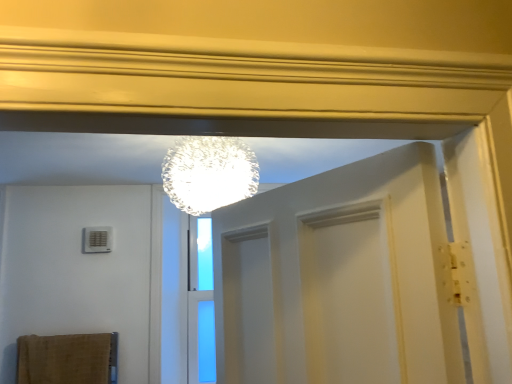
Describe the element at coordinates (67, 359) in the screenshot. The image size is (512, 384). I see `burlap bath towel at lower left` at that location.

Measure the distance between point (x=62, y=342) and camera.

Point (x=62, y=342) is 7.73 feet from camera.

In order to click on burlap bath towel at lower left in this screenshot , I will do `click(67, 359)`.

The height and width of the screenshot is (384, 512). What are the coordinates of `transparent glass sphere at upper center` in the screenshot? It's located at (209, 173).

In order to face transparent glass sphere at upper center, should I rotate leftwards or rightwards?

Turn left by 4.667 degrees to look at transparent glass sphere at upper center.

This screenshot has width=512, height=384. What do you see at coordinates (209, 173) in the screenshot?
I see `transparent glass sphere at upper center` at bounding box center [209, 173].

At what (x,y) coordinates should I click in order to perform the action: click on burlap bath towel at lower left. Please return your answer as a coordinate pair (x, y). Image resolution: width=512 pixels, height=384 pixels. Looking at the image, I should click on (67, 359).

Is burlap bath towel at lower left to the left of transparent glass sphere at upper center from the viewer's perspective?

Yes, burlap bath towel at lower left is to the left of transparent glass sphere at upper center.

Which object is further away from the camera, burlap bath towel at lower left or transparent glass sphere at upper center?

burlap bath towel at lower left is more distant.

Considering the points (54, 349) and (179, 201), which point is in front, point (54, 349) or point (179, 201)?

Positioned in front is point (179, 201).

From the image's perspective, between burlap bath towel at lower left and transparent glass sphere at upper center, which one is located above?

transparent glass sphere at upper center.

From a real-world perspective, is burlap bath towel at lower left physically located above or below transparent glass sphere at upper center?

burlap bath towel at lower left is situated lower than transparent glass sphere at upper center in the real world.

Can you confirm if burlap bath towel at lower left is wider than transparent glass sphere at upper center?

No.

Is burlap bath towel at lower left shorter than transparent glass sphere at upper center?

Yes.

Looking at this image, who is bigger, burlap bath towel at lower left or transparent glass sphere at upper center?

With larger size is transparent glass sphere at upper center.

Can we say burlap bath towel at lower left lies outside transparent glass sphere at upper center?

Yes, burlap bath towel at lower left is not within transparent glass sphere at upper center.

Is burlap bath towel at lower left far away from transparent glass sphere at upper center?

Absolutely, burlap bath towel at lower left is distant from transparent glass sphere at upper center.

Is burlap bath towel at lower left aimed at transparent glass sphere at upper center?

No.

The width and height of the screenshot is (512, 384). What are the coordinates of `lamp above the burlap bath towel at lower left (from the image's perspective)` in the screenshot? It's located at pos(209,173).

Would you say transparent glass sphere at upper center is to the left or to the right of burlap bath towel at lower left in the picture?

In the image, transparent glass sphere at upper center appears on the right side of burlap bath towel at lower left.

Which object is further away from the camera, transparent glass sphere at upper center or burlap bath towel at lower left?

Positioned behind is burlap bath towel at lower left.

Is point (247, 190) farther from viewer compared to point (116, 347)?

No, (247, 190) is closer to viewer.

From the image's perspective, which one is positioned lower, transparent glass sphere at upper center or burlap bath towel at lower left?

From the image's view, burlap bath towel at lower left is below.

From a real-world perspective, which is physically below, transparent glass sphere at upper center or burlap bath towel at lower left?

burlap bath towel at lower left, from a real-world perspective.

Considering the sizes of objects transparent glass sphere at upper center and burlap bath towel at lower left in the image provided, who is thinner, transparent glass sphere at upper center or burlap bath towel at lower left?

burlap bath towel at lower left is thinner.

Is transparent glass sphere at upper center taller or shorter than burlap bath towel at lower left?

Considering their sizes, transparent glass sphere at upper center has more height than burlap bath towel at lower left.

Is transparent glass sphere at upper center bigger than burlap bath towel at lower left?

Indeed, transparent glass sphere at upper center has a larger size compared to burlap bath towel at lower left.

Is transparent glass sphere at upper center completely or partially outside of burlap bath towel at lower left?

Indeed, transparent glass sphere at upper center is completely outside burlap bath towel at lower left.

Can you see transparent glass sphere at upper center touching burlap bath towel at lower left?

No, transparent glass sphere at upper center is not beside burlap bath towel at lower left.

Is transparent glass sphere at upper center oriented away from burlap bath towel at lower left?

No, burlap bath towel at lower left is not at the back of transparent glass sphere at upper center.

Where is `bath towel below the transparent glass sphere at upper center (from the image's perspective)`? Image resolution: width=512 pixels, height=384 pixels. bath towel below the transparent glass sphere at upper center (from the image's perspective) is located at coordinates (67, 359).

The height and width of the screenshot is (384, 512). There is a burlap bath towel at lower left. Identify the location of lamp above it (from a real-world perspective). (209, 173).

What are the coordinates of `lamp in front of the burlap bath towel at lower left` in the screenshot? It's located at (209, 173).